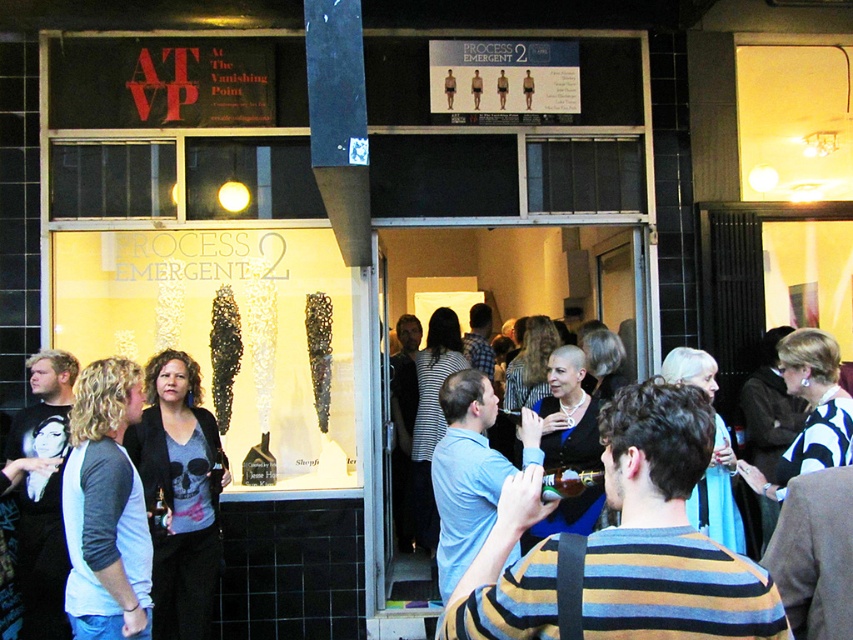
What do you see at coordinates (666, 531) in the screenshot? The height and width of the screenshot is (640, 853). I see `striped sweater at center` at bounding box center [666, 531].

I want to click on striped sweater at center, so click(x=666, y=531).

Is striped sweater at center in front of white cotton t-shirt at center-left?

Yes.

The image size is (853, 640). What do you see at coordinates (666, 531) in the screenshot?
I see `striped sweater at center` at bounding box center [666, 531].

The width and height of the screenshot is (853, 640). Identify the location of striped sweater at center. (666, 531).

Which is in front, point (86, 442) or point (204, 573)?

Point (86, 442) is in front.

Is the position of white cotton t-shirt at center-left more distant than that of matte black jacket at center?

No, it is in front of matte black jacket at center.

This screenshot has height=640, width=853. Identify the location of white cotton t-shirt at center-left. (106, 508).